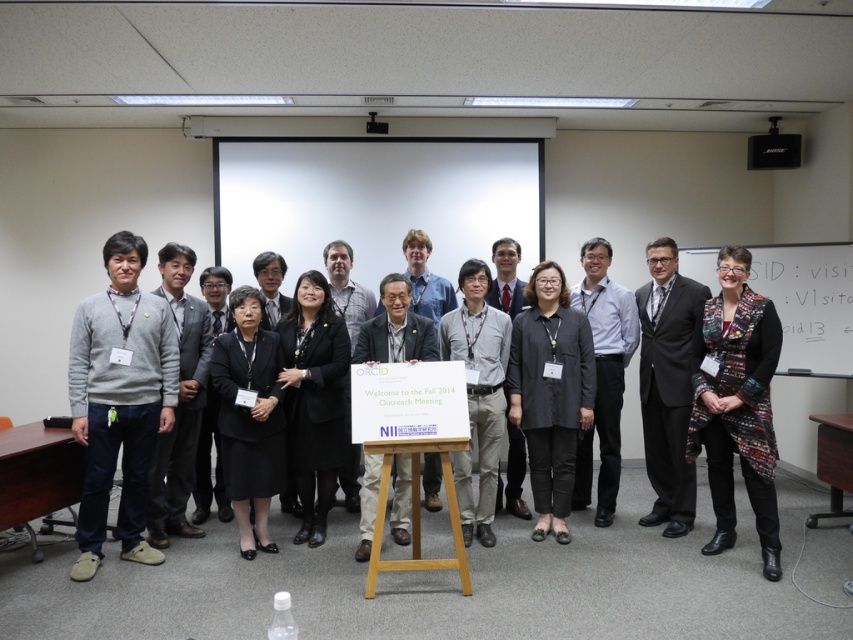
Question: Observing the image, what is the correct spatial positioning of black suit at center in reference to light gray shirt at center?

Choices:
 (A) left
 (B) right

Answer: (B)

Question: Can you confirm if dark gray sweater at center is positioned below light gray shirt at center?

Choices:
 (A) yes
 (B) no

Answer: (A)

Question: Does black suit at center appear on the left side of dark gray sweater at center?

Choices:
 (A) no
 (B) yes

Answer: (A)

Question: Estimate the real-world distances between objects in this image. Which object is closer to the whiteboard at upper right?

Choices:
 (A) multicolored woven vest at right
 (B) light gray shirt at center

Answer: (B)

Question: Which of the following is the farthest from the observer?

Choices:
 (A) black suit at center
 (B) gray sweater at left
 (C) light gray shirt at center

Answer: (C)

Question: Among these points, which one is farthest from the camera?

Choices:
 (A) (538, 394)
 (B) (776, 259)
 (C) (606, 417)
 (D) (144, 316)

Answer: (B)